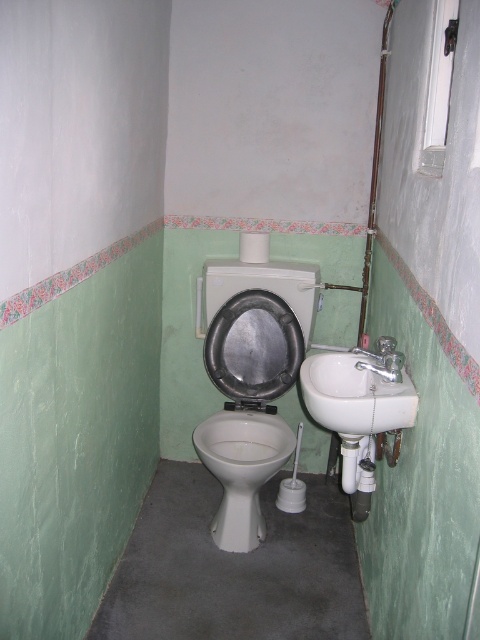
Does white glossy toilet bowl at center have a larger size compared to white ceramic sink at right?

Yes, white glossy toilet bowl at center is bigger than white ceramic sink at right.

Is white glossy toilet bowl at center smaller than white ceramic sink at right?

No, white glossy toilet bowl at center is not smaller than white ceramic sink at right.

The image size is (480, 640). Describe the element at coordinates (241, 468) in the screenshot. I see `white glossy toilet bowl at center` at that location.

Image resolution: width=480 pixels, height=640 pixels. In order to click on white glossy toilet bowl at center in this screenshot , I will do `click(241, 468)`.

Is the position of white glossy toilet bowl at center more distant than that of metallic silver toilet lid at center?

No, it is not.

How much distance is there between white glossy toilet bowl at center and metallic silver toilet lid at center?

white glossy toilet bowl at center and metallic silver toilet lid at center are 11.97 inches apart from each other.

Describe the element at coordinates (241, 468) in the screenshot. I see `white glossy toilet bowl at center` at that location.

The height and width of the screenshot is (640, 480). Identify the location of white glossy toilet bowl at center. (241, 468).

Can you confirm if white glossy toilet at center is wider than white glossy toilet bowl at center?

Yes, white glossy toilet at center is wider than white glossy toilet bowl at center.

Can you confirm if white glossy toilet at center is shorter than white glossy toilet bowl at center?

Incorrect, white glossy toilet at center's height does not fall short of white glossy toilet bowl at center's.

Is point (299, 368) farther from viewer compared to point (252, 452)?

No, it is in front of (252, 452).

I want to click on white glossy toilet at center, so click(x=251, y=380).